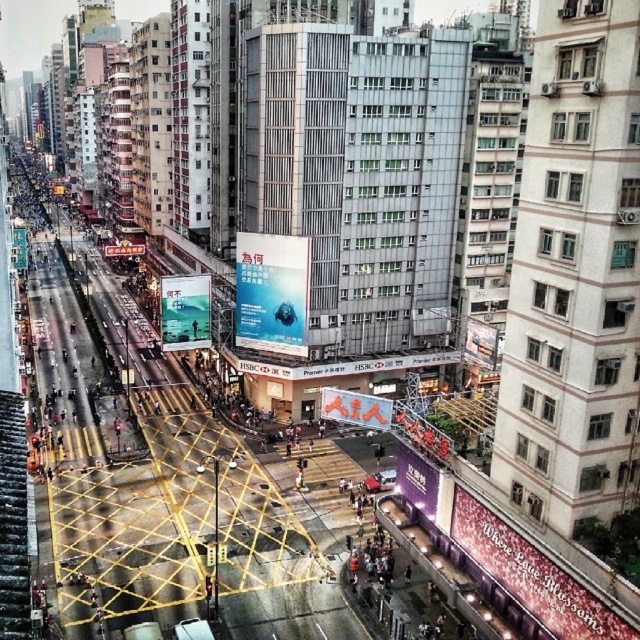
Is blue glossy poster at center further to the viewer compared to purple glossy billboard at lower center?

Yes, it is.

Which is below, blue glossy poster at center or purple glossy billboard at lower center?

purple glossy billboard at lower center is below.

What do you see at coordinates (272, 292) in the screenshot? I see `blue glossy poster at center` at bounding box center [272, 292].

This screenshot has width=640, height=640. I want to click on blue glossy poster at center, so click(272, 292).

Is point (288, 321) in front of point (120, 253)?

That is True.

Who is higher up, blue glossy poster at center or matte white billboard at center?

matte white billboard at center is higher up.

Is point (268, 237) positioned in front of point (124, 244)?

Yes, point (268, 237) is in front of point (124, 244).

The image size is (640, 640). Find the location of `blue glossy poster at center`. blue glossy poster at center is located at coordinates (272, 292).

Does point (550, 593) come in front of point (321, 410)?

Yes, point (550, 593) is in front of point (321, 410).

Is matte pink billboard at lower right taller than matte red sign at center?

Yes.

Does point (584, 611) lie behind point (378, 410)?

No, (584, 611) is in front of (378, 410).

You are a GUI agent. You are given a task and a screenshot of the screen. Output one action in this format:
    pyautogui.click(x=<x>, y=<y>)
    Task: Click on the matte pink billboard at lower right
    This screenshot has height=640, width=640.
    Given the screenshot: What is the action you would take?
    pyautogui.click(x=532, y=576)